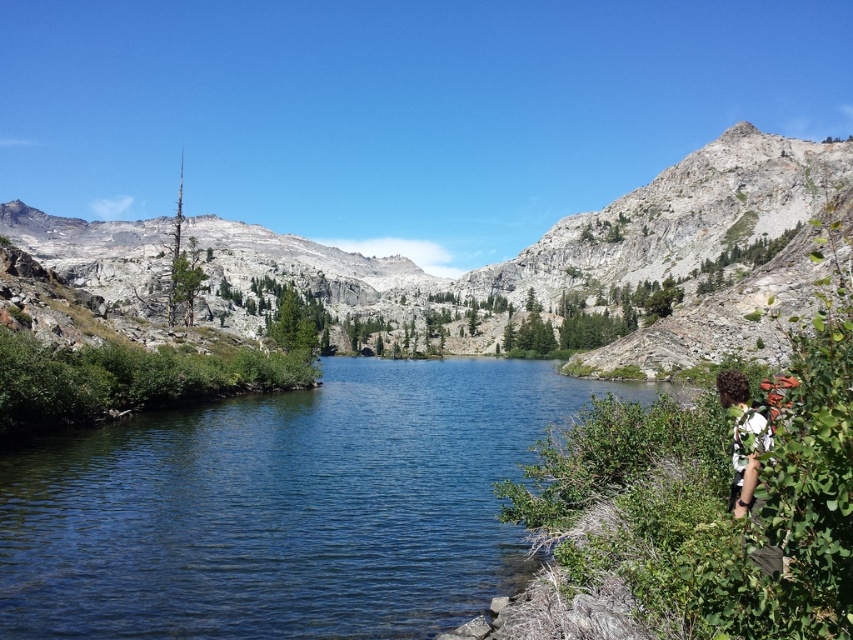
You are standing at the edge of the clear water at center and want to reach the gray rocky mountain at center. Which direction should you go to get there?

The gray rocky mountain at center is taller than the clear water at center, so you should go towards the direction where the gray rocky mountain at center is located.

You are a photographer standing at the edge of the lake. You want to capture a photo of the curly hair at lower right and the clear water at center. Which object is closer to the camera? Explain your reasoning based on their positions.

The curly hair at lower right is closer to the camera because it is positioned above the clear water at center, which is located below it.

You are standing at the edge of the lake and want to take a selfie with both the clear water at center and curly hair at lower right in the frame. Which object should you position closer to the camera to ensure both are visible in the photo?

To include both the clear water at center and curly hair at lower right in the photo, you should position yourself closer to the curly hair at lower right since the clear water at center is much taller and will remain visible even from a distance.